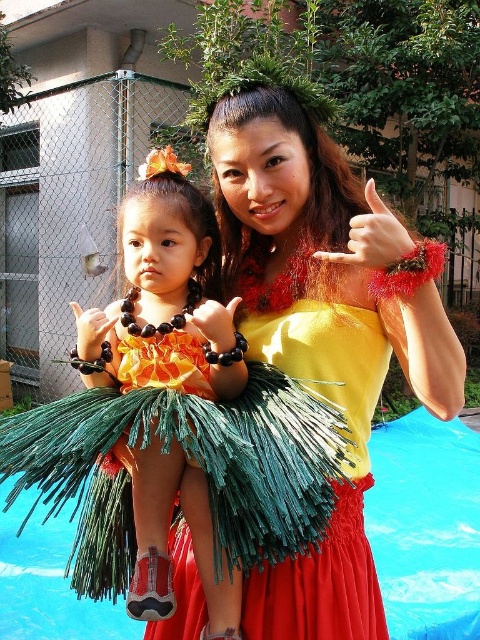
Question: Based on their relative distances, which object is nearer to the orange fabric dress at center?

Choices:
 (A) yellow satin dress at center
 (B) blue plastic pool at center

Answer: (A)

Question: Is orange fabric dress at center to the right of blue plastic pool at center from the viewer's perspective?

Choices:
 (A) yes
 (B) no

Answer: (B)

Question: Which of these objects is positioned farthest from the yellow satin dress at center?

Choices:
 (A) orange fabric dress at center
 (B) blue plastic pool at center

Answer: (B)

Question: Which of the following is the farthest from the observer?

Choices:
 (A) yellow satin dress at center
 (B) blue plastic pool at center

Answer: (B)

Question: Can you confirm if yellow satin dress at center is positioned to the right of blue plastic pool at center?

Choices:
 (A) yes
 (B) no

Answer: (B)

Question: Is yellow satin dress at center positioned in front of blue plastic pool at center?

Choices:
 (A) yes
 (B) no

Answer: (A)